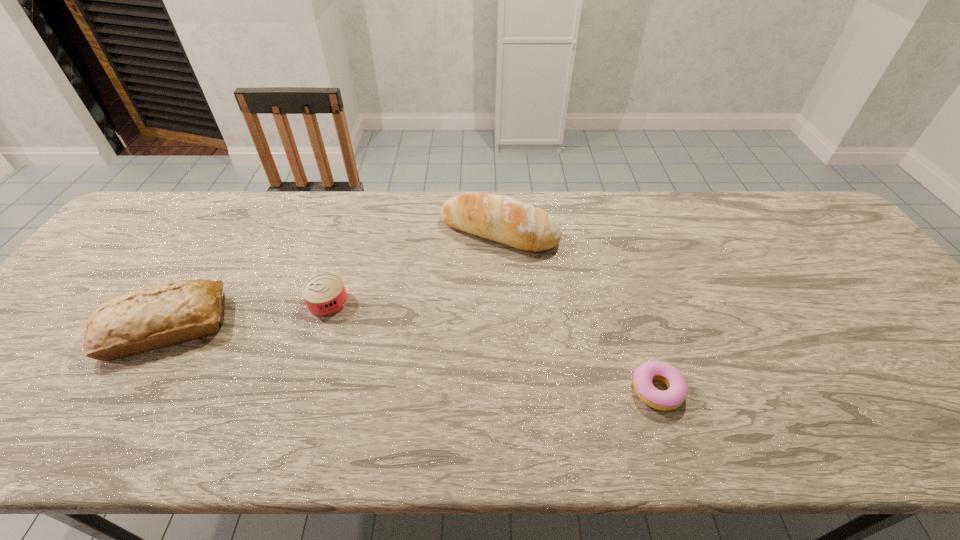
You are a GUI agent. You are given a task and a screenshot of the screen. Output one action in this format:
    pyautogui.click(x=<x>, y=<y>)
    Task: Click on the third object from left to right
    The width and height of the screenshot is (960, 540).
    Given the screenshot: What is the action you would take?
    pyautogui.click(x=504, y=219)

Locate an element on the screen. This screenshot has width=960, height=540. the farthest object is located at coordinates (504, 219).

This screenshot has height=540, width=960. What are the coordinates of `the nearer bread` in the screenshot? It's located at (155, 317).

Locate an element on the screen. the leftmost object is located at coordinates (155, 317).

This screenshot has height=540, width=960. I want to click on can, so click(325, 295).

Identify the location of the third tallest object. The image size is (960, 540). (325, 295).

Locate an element on the screen. This screenshot has width=960, height=540. the shortest object is located at coordinates (670, 399).

Where is `doughnut`? This screenshot has width=960, height=540. doughnut is located at coordinates (670, 399).

Find the location of a particular element. vacant space located 0.400m on the right of the farther bread is located at coordinates (689, 231).

What are the coordinates of `free spot located 0.380m on the right of the left bread` in the screenshot? It's located at (383, 327).